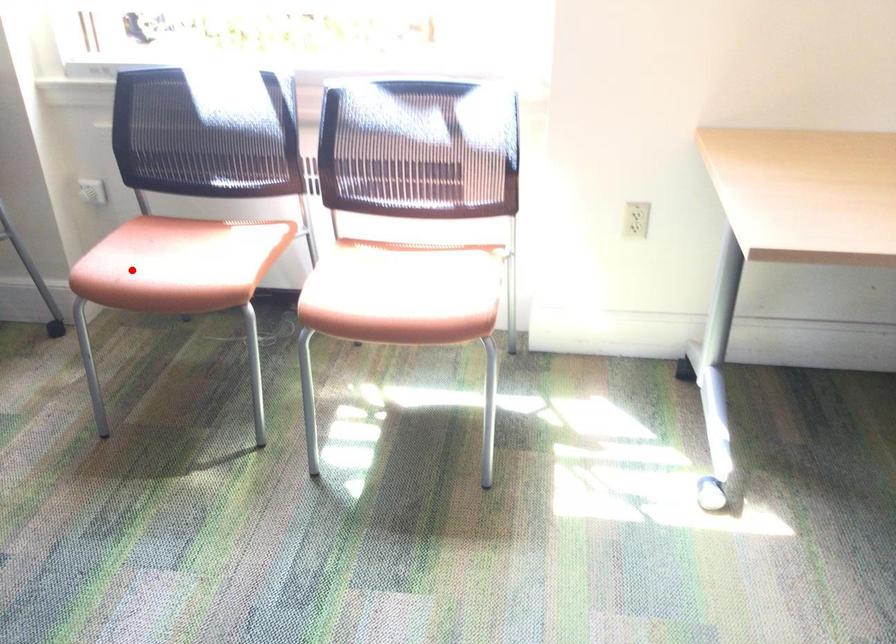
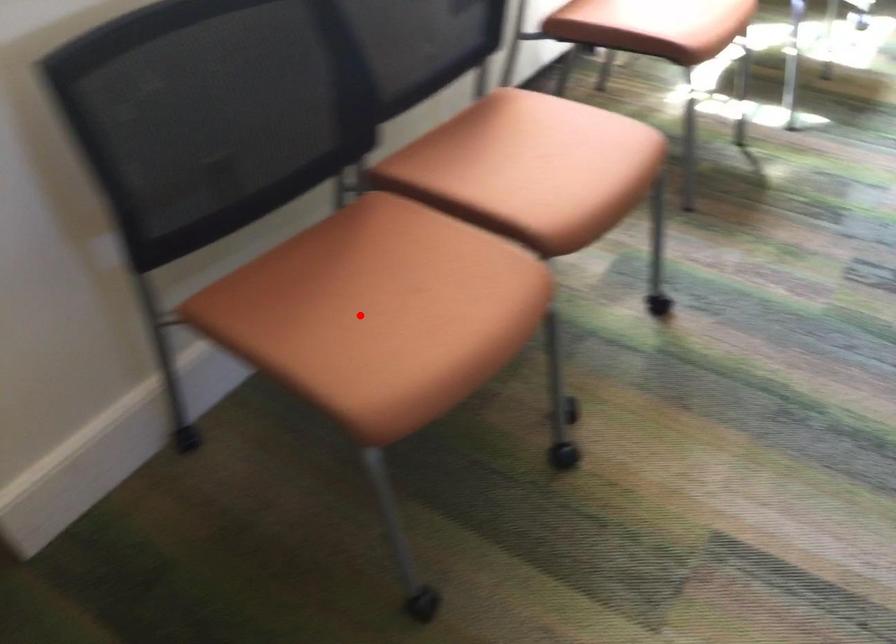
I am providing you with two images of the same scene from different viewpoints. A red point is marked on the first image and another point is marked on the second image. Do the highlighted points in image1 and image2 indicate the same real-world spot?

No